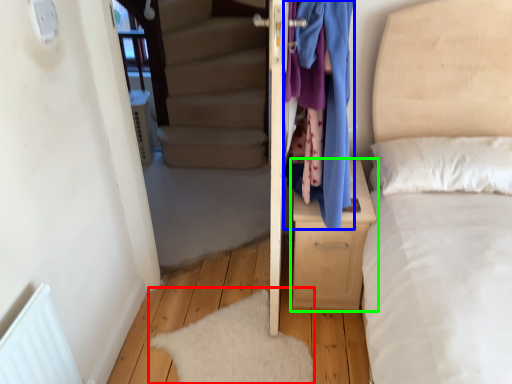
Question: Considering the real-world distances, which object is closest to mat (highlighted by a red box)? clothing (highlighted by a blue box) or nightstand (highlighted by a green box).

Choices:
 (A) clothing
 (B) nightstand

Answer: (B)